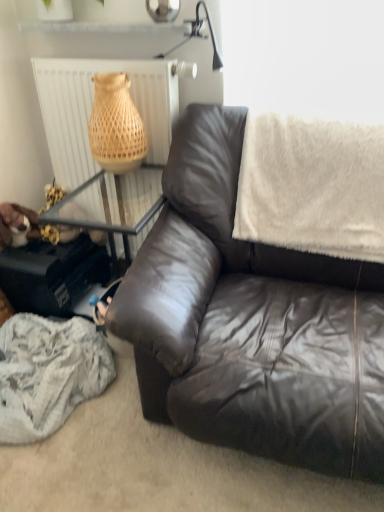
What is the approximate height of white textured radiator at upper left?

The height of white textured radiator at upper left is 94.37 centimeters.

Image resolution: width=384 pixels, height=512 pixels. Describe the element at coordinates (91, 109) in the screenshot. I see `white textured radiator at upper left` at that location.

The image size is (384, 512). Describe the element at coordinates (251, 322) in the screenshot. I see `matte brown leather couch at center` at that location.

Find the location of `white textured radiator at upper left`. white textured radiator at upper left is located at coordinates (91, 109).

Considering the relative sizes of matte brown leather couch at center and white fluffy blanket at upper right in the image provided, is matte brown leather couch at center shorter than white fluffy blanket at upper right?

In fact, matte brown leather couch at center may be taller than white fluffy blanket at upper right.

From a real-world perspective, between matte brown leather couch at center and white fluffy blanket at upper right, who is vertically higher?

white fluffy blanket at upper right.

Which object is closer to the camera taking this photo, matte brown leather couch at center or white fluffy blanket at upper right?

matte brown leather couch at center is more forward.

In the scene shown: From the image's perspective, is matte brown leather couch at center beneath white fluffy blanket at upper right?

Yes, from the image's perspective, matte brown leather couch at center is below white fluffy blanket at upper right.

Does white fluffy blanket at upper right contain matte brown leather couch at center?

No, white fluffy blanket at upper right does not contain matte brown leather couch at center.

Considering the sizes of white fluffy blanket at upper right and matte brown leather couch at center in the image, is white fluffy blanket at upper right bigger or smaller than matte brown leather couch at center?

Result: Clearly, white fluffy blanket at upper right is smaller in size than matte brown leather couch at center.

From the image's perspective, between white fluffy blanket at upper right and matte brown leather couch at center, which one is located above?

white fluffy blanket at upper right, from the image's perspective.

Is white fluffy blanket at upper right positioned behind matte brown leather couch at center?

Yes, it is.

Measure the distance between white textured radiator at upper left and matte brown leather couch at center.

25.14 inches.

From a real-world perspective, is white textured radiator at upper left positioned over matte brown leather couch at center based on gravity?

Indeed, from a real-world perspective, white textured radiator at upper left stands above matte brown leather couch at center.

From the image's perspective, is white textured radiator at upper left on top of matte brown leather couch at center?

Correct, white textured radiator at upper left appears higher than matte brown leather couch at center in the image.

Is matte brown leather couch at center inside white textured radiator at upper left?

No, white textured radiator at upper left does not contain matte brown leather couch at center.

Is white fluffy blanket at upper right further to camera compared to white textured radiator at upper left?

No, white fluffy blanket at upper right is closer to the camera.

The image size is (384, 512). In order to click on radiator behind the white fluffy blanket at upper right in this screenshot , I will do `click(91, 109)`.

Can you confirm if white fluffy blanket at upper right is shorter than white textured radiator at upper left?

Yes.

Is white textured radiator at upper left oriented away from white fluffy blanket at upper right?

No, white textured radiator at upper left is not facing the opposite direction of white fluffy blanket at upper right.

Who is bigger, white textured radiator at upper left or white fluffy blanket at upper right?

Bigger between the two is white textured radiator at upper left.

Image resolution: width=384 pixels, height=512 pixels. I want to click on radiator that is above the white fluffy blanket at upper right (from the image's perspective), so click(91, 109).

Between white textured radiator at upper left and white fluffy blanket at upper right, which one appears on the right side from the viewer's perspective?

From the viewer's perspective, white fluffy blanket at upper right appears more on the right side.

Can you confirm if matte brown leather couch at center is taller than white textured radiator at upper left?

No.

Is point (197, 325) more distant than point (168, 101)?

No, (197, 325) is closer to viewer.

Visually, is matte brown leather couch at center positioned to the left or to the right of white textured radiator at upper left?

In the image, matte brown leather couch at center appears on the right side of white textured radiator at upper left.

Could white textured radiator at upper left be considered to be inside matte brown leather couch at center?

No, matte brown leather couch at center does not contain white textured radiator at upper left.

Where is `blanket lying behind the matte brown leather couch at center`? blanket lying behind the matte brown leather couch at center is located at coordinates (312, 185).

I want to click on studio couch below the white fluffy blanket at upper right (from a real-world perspective), so click(x=251, y=322).

Looking at the image, which one is located closer to white textured radiator at upper left, white fluffy blanket at upper right or matte brown leather couch at center?

white fluffy blanket at upper right is closer to white textured radiator at upper left.

When comparing their distances from white textured radiator at upper left, does matte brown leather couch at center or white fluffy blanket at upper right seem further?

Among the two, matte brown leather couch at center is located further to white textured radiator at upper left.

Estimate the real-world distances between objects in this image. Which object is further from matte brown leather couch at center, white textured radiator at upper left or white fluffy blanket at upper right?

The object further to matte brown leather couch at center is white textured radiator at upper left.

Considering their positions, is matte brown leather couch at center positioned further to white fluffy blanket at upper right than white textured radiator at upper left?

white textured radiator at upper left is positioned further to the anchor white fluffy blanket at upper right.

From the image, which object appears to be farther from matte brown leather couch at center, white fluffy blanket at upper right or white textured radiator at upper left?

Among the two, white textured radiator at upper left is located further to matte brown leather couch at center.

Consider the image. Considering their positions, is white textured radiator at upper left positioned closer to white fluffy blanket at upper right than matte brown leather couch at center?

Among the two, matte brown leather couch at center is located nearer to white fluffy blanket at upper right.

What are the coordinates of `blanket positioned between matte brown leather couch at center and white textured radiator at upper left from near to far` in the screenshot? It's located at (312, 185).